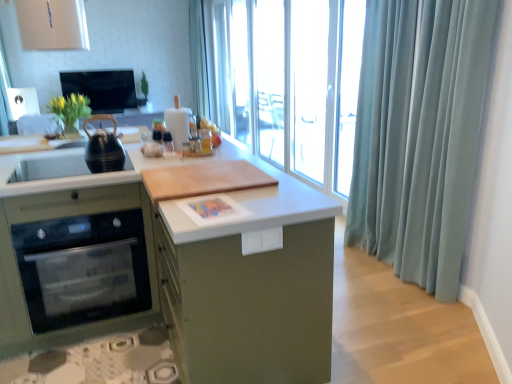
What is the approximate width of light blue fabric at upper center, which is the 1th shower curtain from left to right?

The width of light blue fabric at upper center, which is the 1th shower curtain from left to right, is 9.52 inches.

Describe the element at coordinates (420, 135) in the screenshot. I see `satin blue curtain at right, placed as the second shower curtain when sorted from top to bottom` at that location.

I want to click on white glossy sink at left, so click(49, 167).

What is the approximate width of matte black oven at left?

It is 28.85 inches.

Image resolution: width=512 pixels, height=384 pixels. What do you see at coordinates (103, 89) in the screenshot? I see `matte black tv at upper left` at bounding box center [103, 89].

The image size is (512, 384). Identify the location of light blue fabric at upper center, acting as the first shower curtain starting from the top. (198, 60).

Considering the positions of objects matte black tv at upper left and light blue fabric at upper center, which is counted as the first shower curtain, starting from the back, in the image provided, who is in front, matte black tv at upper left or light blue fabric at upper center, which is counted as the first shower curtain, starting from the back,?

light blue fabric at upper center, which is counted as the first shower curtain, starting from the back, is more forward.

Locate an element on the screen. The width and height of the screenshot is (512, 384). the 1st shower curtain in front of the matte black tv at upper left is located at coordinates (198, 60).

Which is nearer, (122, 103) or (197, 44)?

The point (122, 103) is closer.

Is matte black tv at upper left at the left side of light blue fabric at upper center, acting as the second shower curtain starting from the bottom?

Correct, you'll find matte black tv at upper left to the left of light blue fabric at upper center, acting as the second shower curtain starting from the bottom.

Is matte black tv at upper left oriented towards satin blue curtain at right, the 2th shower curtain in the left-to-right sequence?

Yes, matte black tv at upper left is turned towards satin blue curtain at right, the 2th shower curtain in the left-to-right sequence.

Does matte black tv at upper left have a lesser width compared to satin blue curtain at right, acting as the 1th shower curtain starting from the front?

Yes.

Does matte black tv at upper left have a larger size compared to satin blue curtain at right, the 1th shower curtain in the right-to-left sequence?

Incorrect, matte black tv at upper left is not larger than satin blue curtain at right, the 1th shower curtain in the right-to-left sequence.

Is matte black tv at upper left not close to satin blue curtain at right, the 1th shower curtain in the right-to-left sequence?

Indeed, matte black tv at upper left is not near satin blue curtain at right, the 1th shower curtain in the right-to-left sequence.

From the image's perspective, which is below, wooden cutting board at center or white matte drawer at center?

From the image's view, wooden cutting board at center is below.

Which is in front, wooden cutting board at center or white matte drawer at center?

wooden cutting board at center is more forward.

From the picture: Between wooden cutting board at center and white matte drawer at center, which one has larger size?

Bigger between the two is wooden cutting board at center.

In the scene shown: Are wooden cutting board at center and white matte drawer at center located far from each other?

No, wooden cutting board at center is not far from white matte drawer at center.

In terms of width, does wooden cutting board at center look wider or thinner when compared to matte black tv at upper left?

Considering their sizes, wooden cutting board at center looks broader than matte black tv at upper left.

Is wooden cutting board at center oriented away from matte black tv at upper left?

No, wooden cutting board at center is not facing away from matte black tv at upper left.

In the image, is wooden cutting board at center on the left side or the right side of matte black tv at upper left?

wooden cutting board at center is positioned on matte black tv at upper left's right side.

Are black matte kettle at left and white matte drawer at center far apart?

Indeed, black matte kettle at left is not near white matte drawer at center.

This screenshot has width=512, height=384. In the image, there is a white matte drawer at center. In order to click on kitchen appliance above it (from the image's perspective) in this screenshot , I will do `click(103, 147)`.

Is black matte kettle at left at the right side of white matte drawer at center?

No.

Is point (200, 79) farther from viewer compared to point (63, 154)?

Yes, it is.

Considering the relative sizes of light blue fabric at upper center, acting as the first shower curtain starting from the top, and white glossy sink at left in the image provided, is light blue fabric at upper center, acting as the first shower curtain starting from the top, thinner than white glossy sink at left?

Yes, light blue fabric at upper center, acting as the first shower curtain starting from the top, is thinner than white glossy sink at left.

Who is smaller, light blue fabric at upper center, acting as the second shower curtain starting from the bottom, or white glossy sink at left?

Answer: white glossy sink at left.

The width and height of the screenshot is (512, 384). What are the coordinates of `sink below the light blue fabric at upper center, acting as the first shower curtain starting from the top (from the image's perspective)` in the screenshot? It's located at (49, 167).

Which is more to the left, matte black oven at left or black matte kettle at left?

matte black oven at left is more to the left.

Could you tell me if matte black oven at left is facing black matte kettle at left?

No, matte black oven at left is not turned towards black matte kettle at left.

Considering the points (55, 269) and (88, 160), which point is in front, point (55, 269) or point (88, 160)?

The point (55, 269) is closer.

From a real-world perspective, is matte black oven at left physically located above or below black matte kettle at left?

matte black oven at left is situated lower than black matte kettle at left in the real world.

The height and width of the screenshot is (384, 512). I want to click on the 1st shower curtain in front of the matte black tv at upper left, counting from the anchor's position, so click(x=198, y=60).

Where is `shower curtain that is below the matte black tv at upper left (from the image's perspective)`? shower curtain that is below the matte black tv at upper left (from the image's perspective) is located at coordinates (420, 135).

Estimate the real-world distances between objects in this image. Which object is further from matte black oven at left, matte black tv at upper left or black matte kettle at left?

matte black tv at upper left.

Estimate the real-world distances between objects in this image. Which object is further from white matte drawer at center, light blue fabric at upper center, arranged as the second shower curtain when viewed from the right, or matte black oven at left?

light blue fabric at upper center, arranged as the second shower curtain when viewed from the right, is positioned further to the anchor white matte drawer at center.

From the image, which object appears to be nearer to white matte drawer at center, satin blue curtain at right, positioned as the second shower curtain in back-to-front order, or matte black tv at upper left?

satin blue curtain at right, positioned as the second shower curtain in back-to-front order, is positioned closer to the anchor white matte drawer at center.

Looking at the image, which one is located closer to light blue fabric at upper center, arranged as the second shower curtain when viewed from the front, black matte kettle at left or white matte drawer at center?

black matte kettle at left.

Looking at the image, which one is located closer to white matte drawer at center, white glossy sink at left or wooden cutting board at center?

Among the two, wooden cutting board at center is located nearer to white matte drawer at center.

Estimate the real-world distances between objects in this image. Which object is further from white matte drawer at center, black matte kettle at left or matte black oven at left?

Based on the image, black matte kettle at left appears to be further to white matte drawer at center.

Considering their positions, is matte black tv at upper left positioned further to white glossy sink at left than satin blue curtain at right, the 1th shower curtain in the right-to-left sequence?

The object further to white glossy sink at left is matte black tv at upper left.

Based on their spatial positions, is light blue fabric at upper center, arranged as the second shower curtain when viewed from the front, or white matte drawer at center further from white glossy sink at left?

light blue fabric at upper center, arranged as the second shower curtain when viewed from the front, lies further to white glossy sink at left than the other object.

You are a GUI agent. You are given a task and a screenshot of the screen. Output one action in this format:
    pyautogui.click(x=<x>, y=<y>)
    Task: Click on the cabinetry located between matte black oven at left and satin blue curtain at right, placed as the second shower curtain when sorted from top to bottom, in the left-right direction
    This screenshot has height=384, width=512.
    Given the screenshot: What is the action you would take?
    pyautogui.click(x=167, y=271)

You are a GUI agent. You are given a task and a screenshot of the screen. Output one action in this format:
    pyautogui.click(x=<x>, y=<y>)
    Task: Click on the cabinetry situated between black matte kettle at left and satin blue curtain at right, acting as the 1th shower curtain starting from the front, from left to right
    
    Given the screenshot: What is the action you would take?
    pyautogui.click(x=167, y=271)

Locate an element on the screen. kitchen appliance between white glossy sink at left and matte black tv at upper left along the z-axis is located at coordinates (103, 147).

Where is `shower curtain between white matte drawer at center and light blue fabric at upper center, which is counted as the first shower curtain, starting from the back, along the z-axis`? shower curtain between white matte drawer at center and light blue fabric at upper center, which is counted as the first shower curtain, starting from the back, along the z-axis is located at coordinates (420, 135).